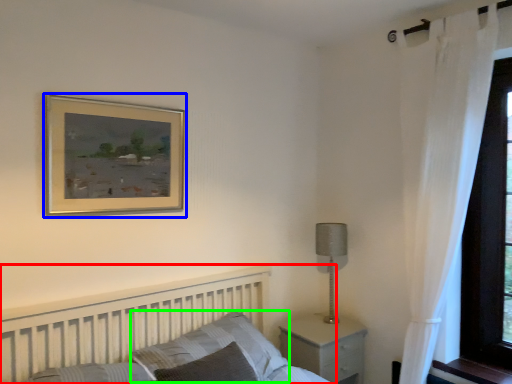
Question: Estimate the real-world distances between objects in this image. Which object is closer to bed (highlighted by a red box), picture frame (highlighted by a blue box) or pillow (highlighted by a green box)?

Choices:
 (A) picture frame
 (B) pillow

Answer: (B)